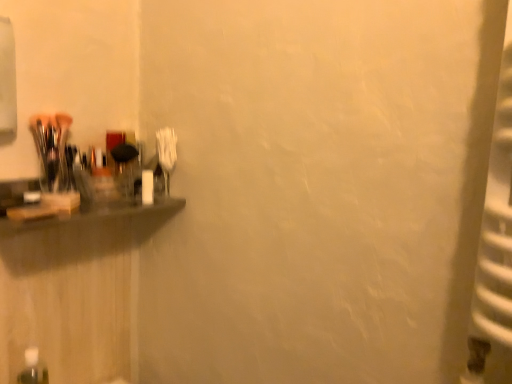
Question: Is transparent plastic bottle at lower left with matte black shelf at left?

Choices:
 (A) yes
 (B) no

Answer: (B)

Question: Is transparent plastic bottle at lower left wider than matte black shelf at left?

Choices:
 (A) no
 (B) yes

Answer: (A)

Question: Is matte black shelf at left at the back of transparent plastic bottle at lower left?

Choices:
 (A) yes
 (B) no

Answer: (B)

Question: From the image's perspective, does transparent plastic bottle at lower left appear lower than matte black shelf at left?

Choices:
 (A) yes
 (B) no

Answer: (A)

Question: Is transparent plastic bottle at lower left shorter than matte black shelf at left?

Choices:
 (A) no
 (B) yes

Answer: (A)

Question: Is transparent plastic bottle at lower left completely or partially outside of matte black shelf at left?

Choices:
 (A) no
 (B) yes

Answer: (B)

Question: Does matte black shelf at left come in front of transparent plastic bottle at lower left?

Choices:
 (A) no
 (B) yes

Answer: (B)

Question: Is matte black shelf at left facing away from transparent plastic bottle at lower left?

Choices:
 (A) no
 (B) yes

Answer: (A)

Question: From a real-world perspective, is matte black shelf at left physically below transparent plastic bottle at lower left?

Choices:
 (A) yes
 (B) no

Answer: (B)

Question: Is matte black shelf at left thinner than transparent plastic bottle at lower left?

Choices:
 (A) yes
 (B) no

Answer: (B)

Question: From the image's perspective, is matte black shelf at left beneath transparent plastic bottle at lower left?

Choices:
 (A) no
 (B) yes

Answer: (A)

Question: Is transparent plastic bottle at lower left a part of matte black shelf at left?

Choices:
 (A) no
 (B) yes

Answer: (A)

Question: From a real-world perspective, relative to matte black shelf at left, is transparent plastic bottle at lower left vertically above or below?

Choices:
 (A) below
 (B) above

Answer: (A)